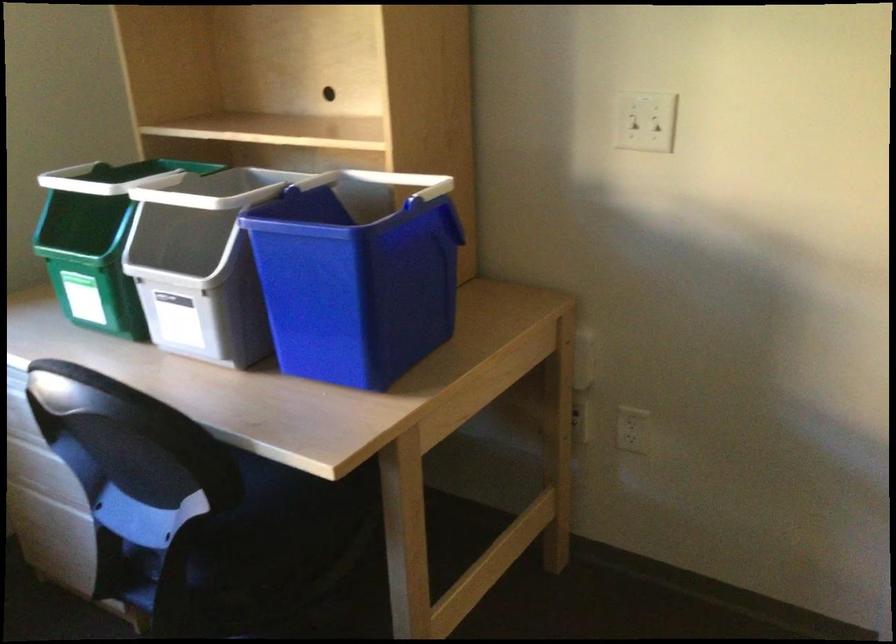
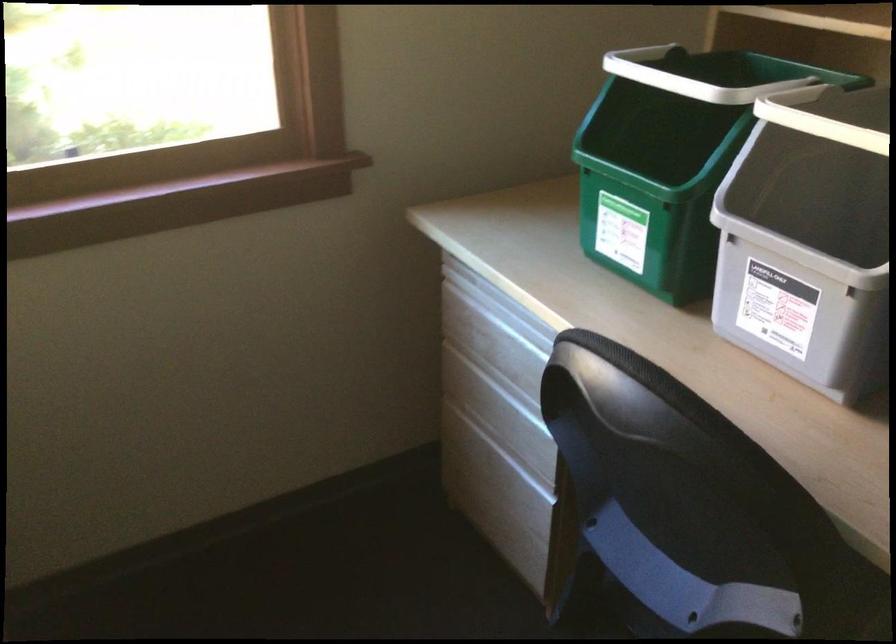
In the second image, find the point that corresponds to point (176, 281) in the first image.

(797, 250)